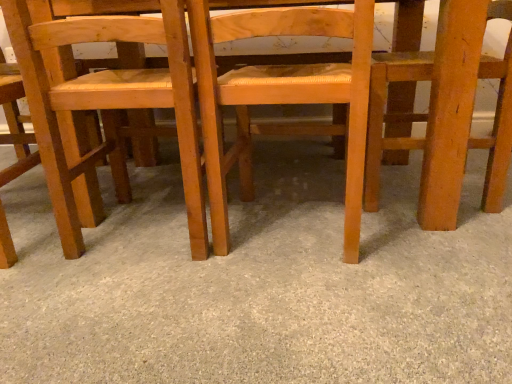
Question: From a real-world perspective, is smooth beige carpet at center located beneath natural wood chair at center, marked as the 2th chair in a left-to-right arrangement?

Choices:
 (A) yes
 (B) no

Answer: (A)

Question: Considering the relative positions of smooth beige carpet at center and natural wood chair at center, the 3th chair viewed from the right, in the image provided, is smooth beige carpet at center to the right of natural wood chair at center, the 3th chair viewed from the right, from the viewer's perspective?

Choices:
 (A) yes
 (B) no

Answer: (A)

Question: From a real-world perspective, is smooth beige carpet at center located higher than natural wood chair at center, marked as the 2th chair in a left-to-right arrangement?

Choices:
 (A) yes
 (B) no

Answer: (B)

Question: From the image's perspective, is smooth beige carpet at center under natural wood chair at center, the 3th chair viewed from the right?

Choices:
 (A) no
 (B) yes

Answer: (B)

Question: Can you confirm if smooth beige carpet at center is shorter than natural wood chair at center, the 3th chair viewed from the right?

Choices:
 (A) no
 (B) yes

Answer: (B)

Question: Is smooth beige carpet at center in front of natural wood chair at center, marked as the 2th chair in a left-to-right arrangement?

Choices:
 (A) no
 (B) yes

Answer: (B)

Question: Is natural wood chair at center, the 3th chair viewed from the right, completely or partially inside light brown wood chair at center, which is counted as the third chair, starting from the left?

Choices:
 (A) yes
 (B) no

Answer: (B)

Question: Is light brown wood chair at center, which appears as the 2th chair when viewed from the right, to the left of natural wood chair at center, marked as the 2th chair in a left-to-right arrangement, from the viewer's perspective?

Choices:
 (A) yes
 (B) no

Answer: (B)

Question: Does light brown wood chair at center, which appears as the 2th chair when viewed from the right, lie behind natural wood chair at center, marked as the 2th chair in a left-to-right arrangement?

Choices:
 (A) yes
 (B) no

Answer: (B)

Question: Does light brown wood chair at center, which is counted as the third chair, starting from the left, have a lesser width compared to natural wood chair at center, the 3th chair viewed from the right?

Choices:
 (A) yes
 (B) no

Answer: (A)

Question: From the image's perspective, is light brown wood chair at center, which appears as the 2th chair when viewed from the right, under natural wood chair at center, marked as the 2th chair in a left-to-right arrangement?

Choices:
 (A) yes
 (B) no

Answer: (A)

Question: Is light brown wood chair at center, which appears as the 2th chair when viewed from the right, closer to camera compared to natural wood chair at center, the 3th chair viewed from the right?

Choices:
 (A) yes
 (B) no

Answer: (A)

Question: Considering the relative sizes of wooden chair at right, which appears as the 1th chair when viewed from the right, and light brown wood chair at left, the 4th chair viewed from the right, in the image provided, is wooden chair at right, which appears as the 1th chair when viewed from the right, shorter than light brown wood chair at left, the 4th chair viewed from the right,?

Choices:
 (A) yes
 (B) no

Answer: (B)